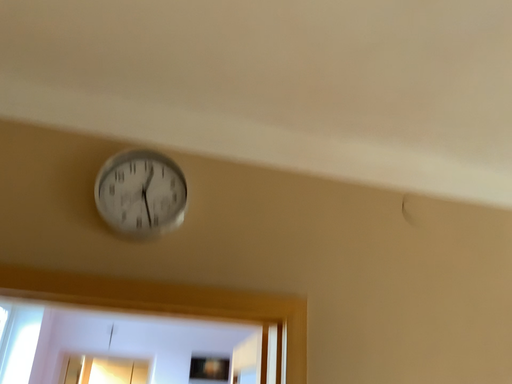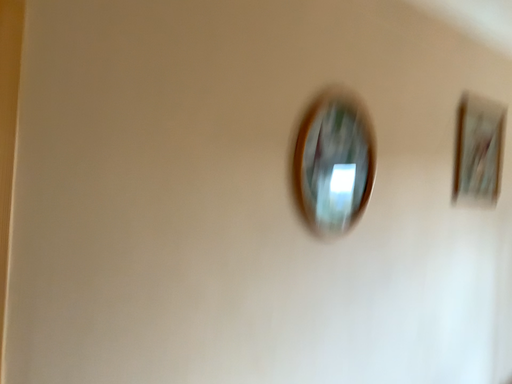
Question: How did the camera likely rotate when shooting the video?

Choices:
 (A) rotated downward
 (B) rotated upward

Answer: (A)